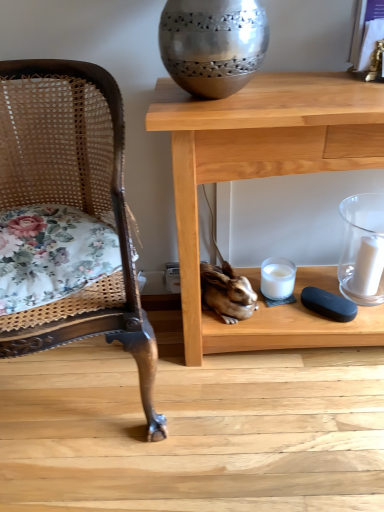
Locate an element on the screen. The width and height of the screenshot is (384, 512). white matte candle at right is located at coordinates (368, 267).

The width and height of the screenshot is (384, 512). In order to click on clear glass candle at right, marked as the 2th candle holder in a left-to-right arrangement in this screenshot , I will do `click(362, 249)`.

Based on the photo, in order to face woven cane chair at left, should I rotate leftwards or rightwards?

You should look left and rotate roughly 19.750 degrees.

You are a GUI agent. You are given a task and a screenshot of the screen. Output one action in this format:
    pyautogui.click(x=<x>, y=<y>)
    Task: Click on the white matte candle at right
    This screenshot has height=512, width=384.
    Given the screenshot: What is the action you would take?
    pyautogui.click(x=368, y=267)

Is wooden table at center further to the viewer compared to clear glass candle at right, acting as the 1th candle holder starting from the right?

No.

Which is correct: wooden table at center is inside clear glass candle at right, acting as the 1th candle holder starting from the right, or outside of it?

wooden table at center is located beyond the bounds of clear glass candle at right, acting as the 1th candle holder starting from the right.

Considering the relative positions of wooden table at center and clear glass candle at right, marked as the 2th candle holder in a left-to-right arrangement, in the image provided, is wooden table at center to the left of clear glass candle at right, marked as the 2th candle holder in a left-to-right arrangement, from the viewer's perspective?

Yes.

Is white matte candle at right outside of white glass candle at lower center, which ranks as the 2th candle holder in right-to-left order?

Indeed, white matte candle at right is completely outside white glass candle at lower center, which ranks as the 2th candle holder in right-to-left order.

From a real-world perspective, is white matte candle at right located beneath white glass candle at lower center, marked as the first candle holder in a left-to-right arrangement?

No, from a real-world perspective, white matte candle at right is not under white glass candle at lower center, marked as the first candle holder in a left-to-right arrangement.

Considering the sizes of objects white matte candle at right and white glass candle at lower center, marked as the first candle holder in a left-to-right arrangement, in the image provided, who is smaller, white matte candle at right or white glass candle at lower center, marked as the first candle holder in a left-to-right arrangement,?

white matte candle at right.

Can you tell me how much white matte candle at right and white glass candle at lower center, which ranks as the 2th candle holder in right-to-left order, differ in facing direction?

The angle between the facing direction of white matte candle at right and the facing direction of white glass candle at lower center, which ranks as the 2th candle holder in right-to-left order, is 5.6 degrees.

How different are the orientations of wooden table at center and white glass candle at lower center, marked as the first candle holder in a left-to-right arrangement, in degrees?

The angular difference between wooden table at center and white glass candle at lower center, marked as the first candle holder in a left-to-right arrangement, is 4.81 degrees.

How distant is wooden table at center from white glass candle at lower center, marked as the first candle holder in a left-to-right arrangement?

13.69 inches.

Considering the relative positions of wooden table at center and white glass candle at lower center, marked as the first candle holder in a left-to-right arrangement, in the image provided, is wooden table at center to the left of white glass candle at lower center, marked as the first candle holder in a left-to-right arrangement, from the viewer's perspective?

Incorrect, wooden table at center is not on the left side of white glass candle at lower center, marked as the first candle holder in a left-to-right arrangement.

Considering the positions of point (365, 128) and point (279, 298), is point (365, 128) closer or farther from the camera than point (279, 298)?

Point (365, 128) is closer to the camera than point (279, 298).

How different are the orientations of white matte candle at right and clear glass candle at right, marked as the 2th candle holder in a left-to-right arrangement, in degrees?

0.459 degrees separate the facing orientations of white matte candle at right and clear glass candle at right, marked as the 2th candle holder in a left-to-right arrangement.

Which is behind, white matte candle at right or clear glass candle at right, marked as the 2th candle holder in a left-to-right arrangement?

Positioned behind is white matte candle at right.

Is white matte candle at right oriented away from clear glass candle at right, acting as the 1th candle holder starting from the right?

That's right, white matte candle at right is facing away from clear glass candle at right, acting as the 1th candle holder starting from the right.

From the image's perspective, which one is positioned higher, white matte candle at right or clear glass candle at right, acting as the 1th candle holder starting from the right?

clear glass candle at right, acting as the 1th candle holder starting from the right, appears higher in the image.

Between clear glass candle at right, acting as the 1th candle holder starting from the right, and wooden table at center, which one has less height?

clear glass candle at right, acting as the 1th candle holder starting from the right.

Could you tell me if clear glass candle at right, acting as the 1th candle holder starting from the right, is turned towards wooden table at center?

Yes, clear glass candle at right, acting as the 1th candle holder starting from the right, is oriented towards wooden table at center.

Which is in front, point (378, 246) or point (181, 212)?

The point (181, 212) is closer.

Between clear glass candle at right, marked as the 2th candle holder in a left-to-right arrangement, and wooden table at center, which one has smaller size?

Smaller between the two is clear glass candle at right, marked as the 2th candle holder in a left-to-right arrangement.

Locate an element on the screen. The image size is (384, 512). candle on the right of the woven cane chair at left is located at coordinates click(368, 267).

Considering the relative positions of white matte candle at right and woven cane chair at left in the image provided, is white matte candle at right to the right of woven cane chair at left from the viewer's perspective?

Correct, you'll find white matte candle at right to the right of woven cane chair at left.

Consider the image. Is white matte candle at right oriented away from woven cane chair at left?

No.

Is white matte candle at right wider than woven cane chair at left?

In fact, white matte candle at right might be narrower than woven cane chair at left.

Can we say wooden table at center lies outside white matte candle at right?

wooden table at center is positioned outside white matte candle at right.

Between wooden table at center and white matte candle at right, which one is positioned behind?

white matte candle at right is more distant.

From the image's perspective, relative to white matte candle at right, is wooden table at center above or below?

Clearly, from the image's perspective, wooden table at center is above white matte candle at right.

From a real-world perspective, which is physically below, wooden table at center or white matte candle at right?

In real-world perspective, white matte candle at right is lower.

Locate an element on the screen. table in front of the clear glass candle at right, marked as the 2th candle holder in a left-to-right arrangement is located at coordinates (266, 176).

At what (x,y) coordinates should I click in order to perform the action: click on candle holder located behind the white matte candle at right. Please return your answer as a coordinate pair (x, y). The width and height of the screenshot is (384, 512). Looking at the image, I should click on (277, 278).

When comparing their distances from wooden table at center, does white glass candle at lower center, which ranks as the 2th candle holder in right-to-left order, or white matte candle at right seem further?

white matte candle at right is positioned further to the anchor wooden table at center.

Considering their positions, is white glass candle at lower center, which ranks as the 2th candle holder in right-to-left order, positioned further to white matte candle at right than woven cane chair at left?

woven cane chair at left.

Considering their positions, is clear glass candle at right, marked as the 2th candle holder in a left-to-right arrangement, positioned further to wooden table at center than woven cane chair at left?

clear glass candle at right, marked as the 2th candle holder in a left-to-right arrangement, lies further to wooden table at center than the other object.

Which object lies nearer to the anchor point white matte candle at right, white glass candle at lower center, marked as the first candle holder in a left-to-right arrangement, or clear glass candle at right, marked as the 2th candle holder in a left-to-right arrangement?

clear glass candle at right, marked as the 2th candle holder in a left-to-right arrangement.

Consider the image. Which object lies further to the anchor point white matte candle at right, wooden table at center or white glass candle at lower center, which ranks as the 2th candle holder in right-to-left order?

wooden table at center lies further to white matte candle at right than the other object.

Looking at the image, which one is located further to white glass candle at lower center, marked as the first candle holder in a left-to-right arrangement, woven cane chair at left or wooden table at center?

Among the two, woven cane chair at left is located further to white glass candle at lower center, marked as the first candle holder in a left-to-right arrangement.

Considering their positions, is wooden table at center positioned closer to white matte candle at right than woven cane chair at left?

wooden table at center lies closer to white matte candle at right than the other object.

From the image, which object appears to be farther from white glass candle at lower center, which ranks as the 2th candle holder in right-to-left order, woven cane chair at left or white matte candle at right?

The object further to white glass candle at lower center, which ranks as the 2th candle holder in right-to-left order, is woven cane chair at left.

Locate an element on the screen. This screenshot has width=384, height=512. candle holder between woven cane chair at left and clear glass candle at right, marked as the 2th candle holder in a left-to-right arrangement is located at coordinates (277, 278).

Where is `candle holder between woven cane chair at left and wooden table at center from left to right`? Image resolution: width=384 pixels, height=512 pixels. candle holder between woven cane chair at left and wooden table at center from left to right is located at coordinates (277, 278).

The width and height of the screenshot is (384, 512). Find the location of `candle holder between white glass candle at lower center, marked as the first candle holder in a left-to-right arrangement, and white matte candle at right from left to right`. candle holder between white glass candle at lower center, marked as the first candle holder in a left-to-right arrangement, and white matte candle at right from left to right is located at coordinates (362, 249).

This screenshot has width=384, height=512. I want to click on candle located between wooden table at center and white glass candle at lower center, which ranks as the 2th candle holder in right-to-left order, in the depth direction, so click(x=368, y=267).